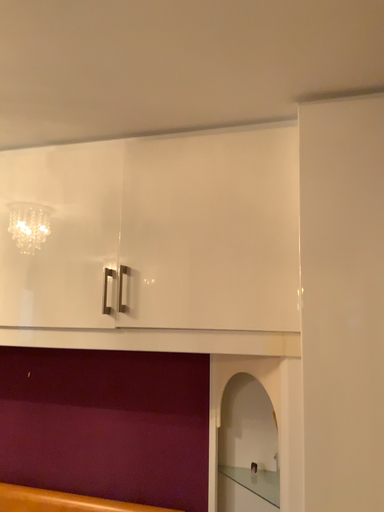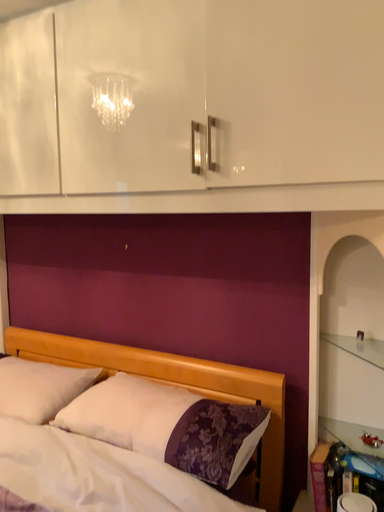
Question: Which way did the camera rotate in the video?

Choices:
 (A) rotated upward
 (B) rotated downward

Answer: (B)